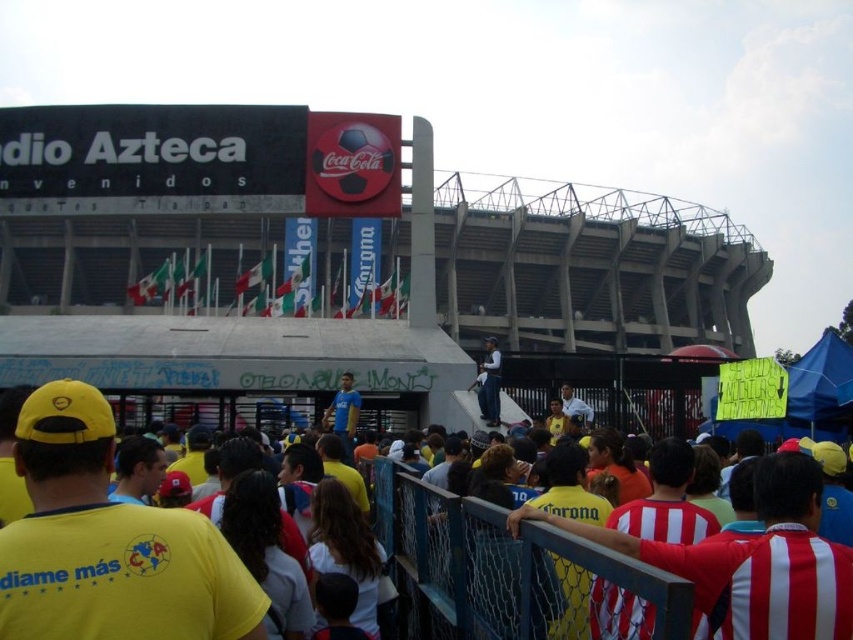
In the scene shown: You are standing at the entrance of Estadio Azteca and see a yellow fabric shirt at center and a dark blue uniform at center. Which one is nearer to you?

The yellow fabric shirt at center is closer to the viewer than the dark blue uniform at center, so the yellow fabric shirt at center is nearer to you.

You are a photographer at Estadio Azteca and want to capture a photo of the yellow fabric shirt at center and the dark blue uniform at center. Which of the two clothing items appears wider in the photo?

The yellow fabric shirt at center appears wider than the dark blue uniform at center in the photo because the yellow fabric shirt at center has a greater width compared to the dark blue uniform at center.

You are a photographer at Estadio Azteca and need to capture a photo of the yellow fabric shirt at center and the dark blue uniform at center. Which one should you focus on first if you want to include both in your shot without moving the camera?

The yellow fabric shirt at center is located below the dark blue uniform at center, so you should focus on the dark blue uniform at center first to ensure both are in frame.